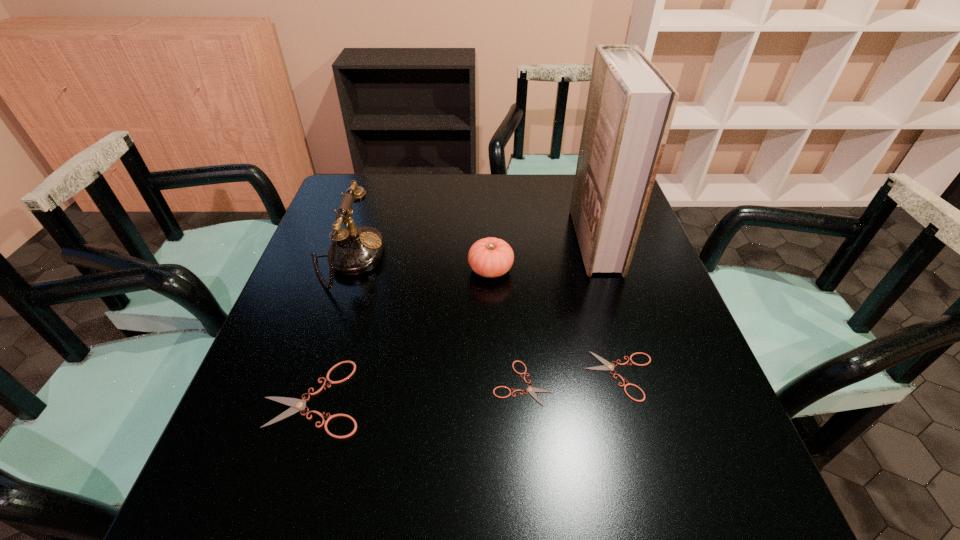
You are a GUI agent. You are given a task and a screenshot of the screen. Output one action in this format:
    pyautogui.click(x=<x>, y=<y>)
    Task: Click on the object that is the third closest to the shortest object
    This screenshot has height=540, width=960.
    Given the screenshot: What is the action you would take?
    pyautogui.click(x=297, y=405)

The width and height of the screenshot is (960, 540). What are the coordinates of `shears that is the closest to the second shortest object` in the screenshot? It's located at click(x=530, y=389).

Identify the location of shears identified as the second closest to the tomato. (607, 365).

Identify the location of vacant area that satisfies the following two spatial constraints: 1. on the dial of the second tallest object; 2. on the right side of the tomato. This screenshot has height=540, width=960. (343, 269).

Where is `free location that satisfies the following two spatial constraints: 1. on the dial of the tallest shears; 2. on the left side of the telephone`? The image size is (960, 540). free location that satisfies the following two spatial constraints: 1. on the dial of the tallest shears; 2. on the left side of the telephone is located at coordinates (300, 397).

The height and width of the screenshot is (540, 960). I want to click on vacant point that satisfies the following two spatial constraints: 1. on the cover of the phonebook; 2. on the front side of the second shortest shears, so click(x=636, y=376).

At what (x,y) coordinates should I click in order to perform the action: click on vacant area that satisfies the following two spatial constraints: 1. on the dial of the telephone; 2. on the left side of the second shears from right to left. Please return your answer as a coordinate pair (x, y). Looking at the image, I should click on (305, 383).